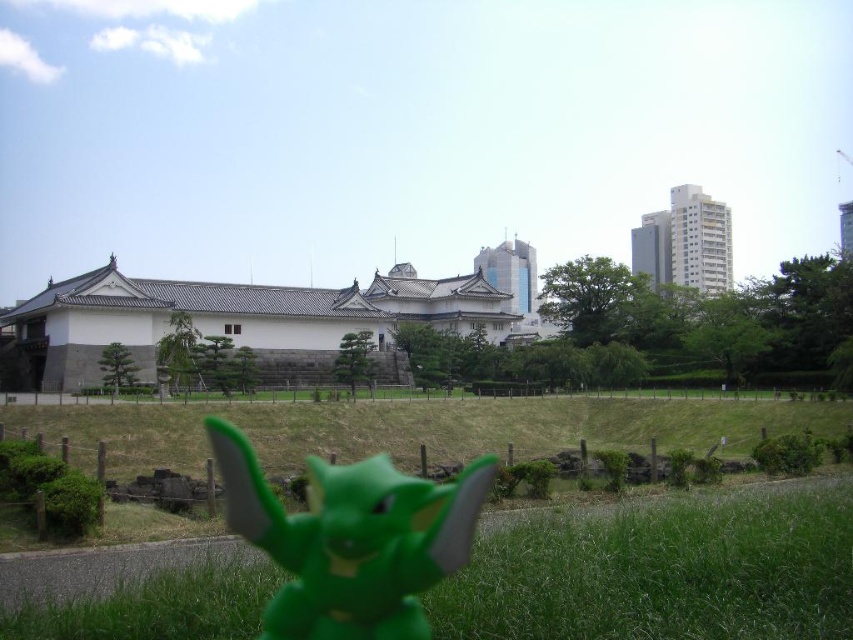
Can you confirm if green grass at lower left is positioned to the right of green matte toy at center?

Yes, green grass at lower left is to the right of green matte toy at center.

Is green grass at lower left taller than green matte toy at center?

No, green grass at lower left is not taller than green matte toy at center.

I want to click on green grass at lower left, so click(x=415, y=428).

This screenshot has height=640, width=853. I want to click on green grass at lower left, so click(x=415, y=428).

Is green matte grass at lower center thinner than green matte toy at center?

Incorrect, green matte grass at lower center's width is not less than green matte toy at center's.

Which is below, green matte grass at lower center or green matte toy at center?

green matte toy at center is below.

Identify the location of green matte grass at lower center. (663, 572).

Looking at this image, does green matte grass at lower center have a smaller size compared to green grass at lower left?

Correct, green matte grass at lower center occupies less space than green grass at lower left.

Between point (577, 636) and point (200, 410), which one is positioned in front?

Positioned in front is point (577, 636).

Between point (253, 611) and point (102, 536), which one is positioned behind?

The point (102, 536) is more distant.

In order to click on green matte grass at lower center in this screenshot , I will do `click(663, 572)`.